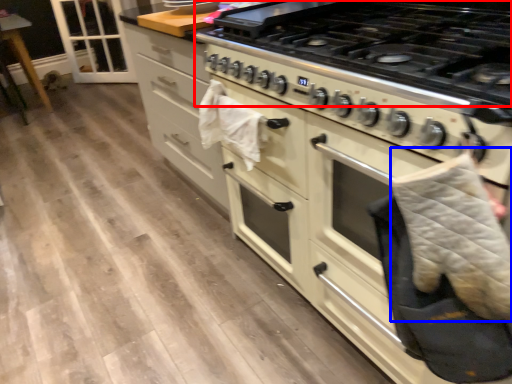
Question: Which object appears farthest to the camera in this image, gas stove (highlighted by a red box) or blanket (highlighted by a blue box)?

Choices:
 (A) gas stove
 (B) blanket

Answer: (A)